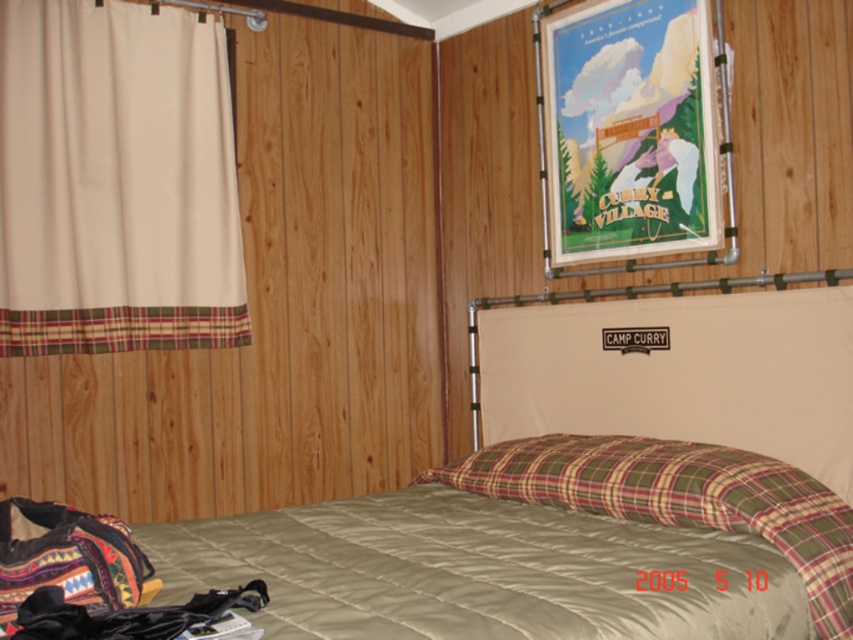
Does green quilted bed at center appear on the left side of plaid fabric pillow at center?

Yes, green quilted bed at center is to the left of plaid fabric pillow at center.

Which is behind, point (514, 321) or point (601, 496)?

The point (514, 321) is behind.

Identify the location of green quilted bed at center. (480, 576).

This screenshot has width=853, height=640. Identify the location of green quilted bed at center. (480, 576).

Which is in front, point (587, 205) or point (711, 468)?

Point (711, 468) is in front.

Is point (695, 12) closer to camera compared to point (486, 468)?

Yes, it is.

In order to click on matte paper poster at upper center in this screenshot , I will do `click(628, 131)`.

This screenshot has width=853, height=640. Describe the element at coordinates (480, 576) in the screenshot. I see `green quilted bed at center` at that location.

Does green quilted bed at center appear over beige fabric curtain at left?

Incorrect, green quilted bed at center is not positioned above beige fabric curtain at left.

This screenshot has width=853, height=640. What do you see at coordinates (480, 576) in the screenshot? I see `green quilted bed at center` at bounding box center [480, 576].

Locate an element on the screen. The image size is (853, 640). green quilted bed at center is located at coordinates click(x=480, y=576).